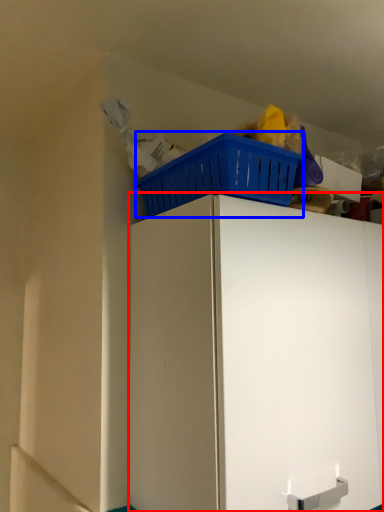
Question: Which point is further to the camera, cabinetry (highlighted by a red box) or basket (highlighted by a blue box)?

Choices:
 (A) cabinetry
 (B) basket

Answer: (B)